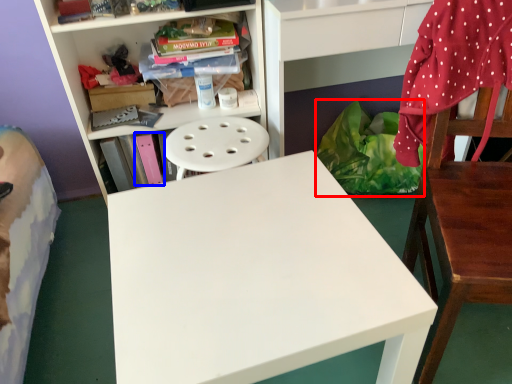
Question: Which point is further to the camera, material (highlighted by a red box) or book (highlighted by a blue box)?

Choices:
 (A) material
 (B) book

Answer: (A)